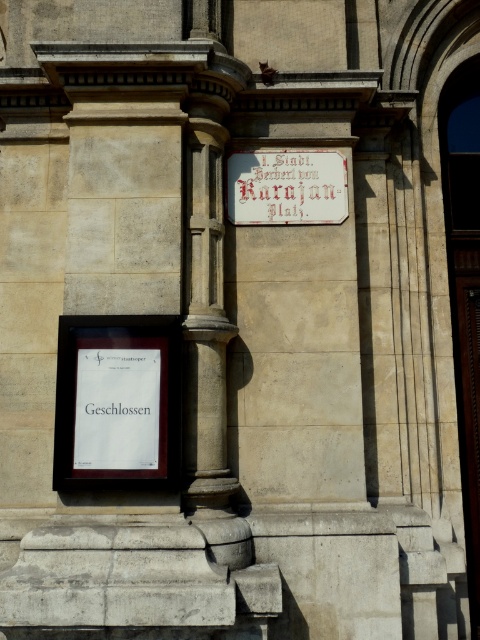
You are standing in front of the stone building and want to read both the white paper poster at lower left and the white wood sign at center. Which object is nearer to you, the viewer?

The white paper poster at lower left is closer to the viewer than the white wood sign at center.

You are an event planner who needs to hang a new poster that is 3.5 inches wide in this area. You see the white paper poster at lower left and the white paper sign at lower left. Can you place your new poster between them without overlapping?

The white paper poster at lower left is 3.40 inches away from the white paper sign at lower left. Since the distance between them is only 3.40 inches and your new poster is 3.5 inches wide, it won not fit without overlapping. You should choose another location.

You are a tourist in the area and want to read both the white paper poster at lower left and the white paper sign at lower left. Which one do you need to look up higher to see?

The white paper poster at lower left is much taller than the white paper sign at lower left, so you need to look up higher to see the white paper poster at lower left.